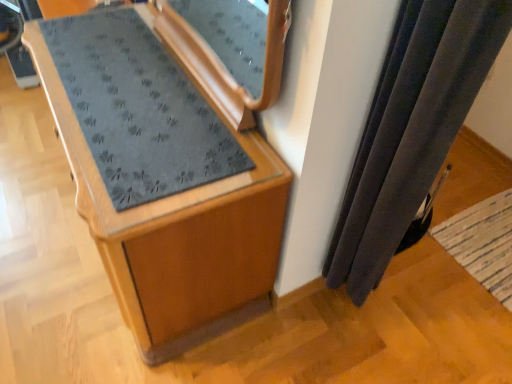
Where is `woven beige mat at lower right`? Image resolution: width=512 pixels, height=384 pixels. woven beige mat at lower right is located at coordinates (483, 243).

At what (x,y) coordinates should I click in order to perform the action: click on velvet dark gray curtain at right. Please return your answer as a coordinate pair (x, y). Looking at the image, I should click on (412, 130).

You are a GUI agent. You are given a task and a screenshot of the screen. Output one action in this format:
    pyautogui.click(x=<x>, y=<y>)
    Task: Click on the woven beige mat at lower right
    This screenshot has width=512, height=384.
    Given the screenshot: What is the action you would take?
    pyautogui.click(x=483, y=243)

Which of these two, velvet dark gray curtain at right or wooden cabinet at center, is smaller?

With smaller size is velvet dark gray curtain at right.

Would you say velvet dark gray curtain at right contains wooden cabinet at center?

That's incorrect, wooden cabinet at center is not inside velvet dark gray curtain at right.

Is velvet dark gray curtain at right facing away from wooden cabinet at center?

velvet dark gray curtain at right does not have its back to wooden cabinet at center.

From the image's perspective, which is above, wooden cabinet at center or velvet dark gray curtain at right?

From the image's view, wooden cabinet at center is above.

Is wooden cabinet at center turned away from velvet dark gray curtain at right?

Absolutely, wooden cabinet at center is directed away from velvet dark gray curtain at right.

Is point (208, 153) positioned after point (370, 230)?

No.

Does wooden cabinet at center come in front of velvet dark gray curtain at right?

No.

Considering the sizes of objects wooden cabinet at center and woven beige mat at lower right in the image provided, who is bigger, wooden cabinet at center or woven beige mat at lower right?

Bigger between the two is wooden cabinet at center.

Which of these two, wooden cabinet at center or woven beige mat at lower right, is thinner?

With smaller width is woven beige mat at lower right.

Is the depth of wooden cabinet at center greater than that of woven beige mat at lower right?

No, wooden cabinet at center is closer to the camera.

In the scene shown: From a real-world perspective, does wooden cabinet at center stand above woven beige mat at lower right?

Yes, from a real-world perspective, wooden cabinet at center is on top of woven beige mat at lower right.

Does woven beige mat at lower right have a smaller size compared to velvet dark gray curtain at right?

Yes, woven beige mat at lower right is smaller than velvet dark gray curtain at right.

Is woven beige mat at lower right not inside velvet dark gray curtain at right?

Yes, woven beige mat at lower right is located beyond the bounds of velvet dark gray curtain at right.

From the image's perspective, which object appears higher, woven beige mat at lower right or velvet dark gray curtain at right?

velvet dark gray curtain at right is shown above in the image.

Consider the image. Is woven beige mat at lower right oriented away from velvet dark gray curtain at right?

No.

Can you tell me how much velvet dark gray curtain at right and woven beige mat at lower right differ in facing direction?

92 degrees separate the facing orientations of velvet dark gray curtain at right and woven beige mat at lower right.

Is velvet dark gray curtain at right closer to camera compared to woven beige mat at lower right?

Yes, the depth of velvet dark gray curtain at right is less than that of woven beige mat at lower right.

Is point (388, 254) more distant than point (483, 252)?

That is False.

In order to click on mat that appears on the right of velvet dark gray curtain at right in this screenshot , I will do `click(483, 243)`.

Can you confirm if woven beige mat at lower right is positioned to the left of wooden cabinet at center?

No.

Is woven beige mat at lower right placed right next to wooden cabinet at center?

No.

From the image's perspective, between woven beige mat at lower right and wooden cabinet at center, which one is located above?

From the image's view, wooden cabinet at center is above.

Which is correct: woven beige mat at lower right is inside wooden cabinet at center, or outside of it?

woven beige mat at lower right lies outside wooden cabinet at center.

The height and width of the screenshot is (384, 512). Identify the location of curtain that is in front of the wooden cabinet at center. (412, 130).

Identify the location of furniture located behind the velvet dark gray curtain at right. The height and width of the screenshot is (384, 512). (170, 159).

Considering their positions, is velvet dark gray curtain at right positioned further to woven beige mat at lower right than wooden cabinet at center?

Based on the image, wooden cabinet at center appears to be further to woven beige mat at lower right.

Which object lies further to the anchor point wooden cabinet at center, velvet dark gray curtain at right or woven beige mat at lower right?

Based on the image, woven beige mat at lower right appears to be further to wooden cabinet at center.

Based on the photo, which object lies further to the anchor point wooden cabinet at center, woven beige mat at lower right or velvet dark gray curtain at right?

woven beige mat at lower right is further to wooden cabinet at center.

Which object lies further to the anchor point velvet dark gray curtain at right, wooden cabinet at center or woven beige mat at lower right?

woven beige mat at lower right is positioned further to the anchor velvet dark gray curtain at right.

Based on their spatial positions, is wooden cabinet at center or velvet dark gray curtain at right closer to woven beige mat at lower right?

velvet dark gray curtain at right.

Which object lies further to the anchor point velvet dark gray curtain at right, woven beige mat at lower right or wooden cabinet at center?

Among the two, woven beige mat at lower right is located further to velvet dark gray curtain at right.

Find the location of a particular element. The image size is (512, 384). curtain between wooden cabinet at center and woven beige mat at lower right is located at coordinates (412, 130).